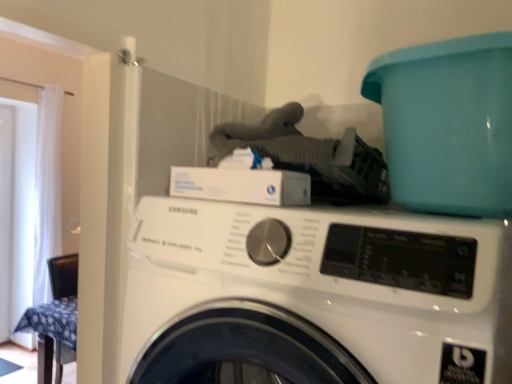
Question: From a real-world perspective, is white sheer curtain at left located higher than teal plastic bucket at upper right?

Choices:
 (A) yes
 (B) no

Answer: (B)

Question: Does white sheer curtain at left have a greater height compared to teal plastic bucket at upper right?

Choices:
 (A) no
 (B) yes

Answer: (B)

Question: Is there a large distance between white sheer curtain at left and teal plastic bucket at upper right?

Choices:
 (A) no
 (B) yes

Answer: (B)

Question: Does white sheer curtain at left appear on the left side of teal plastic bucket at upper right?

Choices:
 (A) yes
 (B) no

Answer: (A)

Question: From the image's perspective, does white sheer curtain at left appear lower than teal plastic bucket at upper right?

Choices:
 (A) yes
 (B) no

Answer: (A)

Question: Is teal plastic bucket at upper right wider or thinner than white sheer curtain at left?

Choices:
 (A) wide
 (B) thin

Answer: (A)

Question: From a real-world perspective, is teal plastic bucket at upper right positioned above or below white sheer curtain at left?

Choices:
 (A) above
 (B) below

Answer: (A)

Question: Choose the correct answer: Is teal plastic bucket at upper right inside white sheer curtain at left or outside it?

Choices:
 (A) outside
 (B) inside

Answer: (A)

Question: Looking at the image, does teal plastic bucket at upper right seem bigger or smaller compared to white sheer curtain at left?

Choices:
 (A) big
 (B) small

Answer: (B)

Question: Is white sheer curtain at left to the left or to the right of white glossy screen door at left in the image?

Choices:
 (A) right
 (B) left

Answer: (A)

Question: Relative to white glossy screen door at left, is white sheer curtain at left in front or behind?

Choices:
 (A) front
 (B) behind

Answer: (A)

Question: From a real-world perspective, relative to white glossy screen door at left, is white sheer curtain at left vertically above or below?

Choices:
 (A) below
 (B) above

Answer: (B)

Question: From the image's perspective, is white sheer curtain at left located above or below white glossy screen door at left?

Choices:
 (A) below
 (B) above

Answer: (B)

Question: Looking at the image, does white glossy screen door at left seem bigger or smaller compared to white glossy washing machine at center?

Choices:
 (A) big
 (B) small

Answer: (B)

Question: From the image's perspective, is white glossy screen door at left located above or below white glossy washing machine at center?

Choices:
 (A) below
 (B) above

Answer: (A)